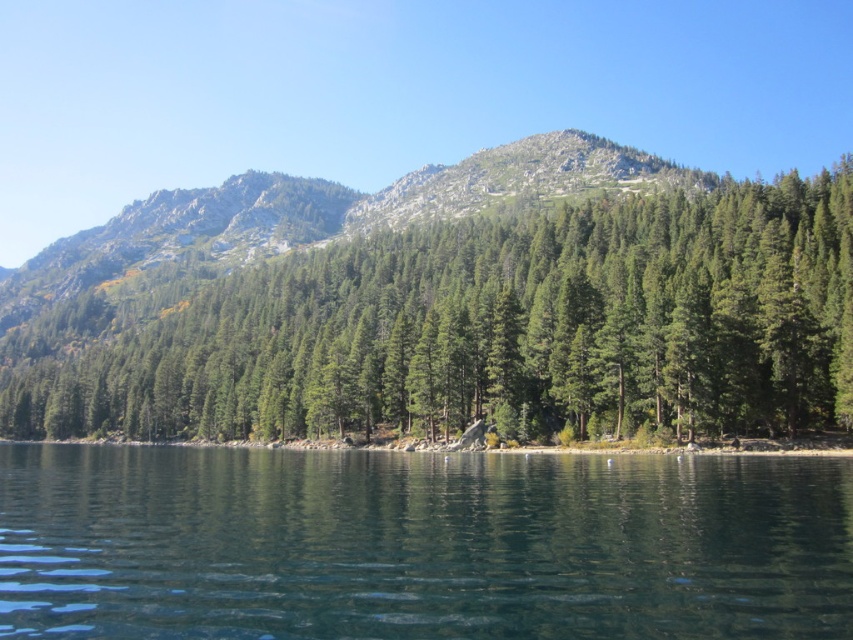
You are standing at the center of the image and want to locate the green matte tree at center. According to the coordinates provided, where exactly would you find it?

The green matte tree at center is located at the coordinates point (480,328).

You are an environmental scientist assessing the health of this forest. You observe the green matte tree at center and the green textured forest at center. Which of these has a smaller trunk diameter?

The green matte tree at center has a smaller trunk diameter than the green textured forest at center.

You are a hiker standing at the edge of the forest. You see the green smooth water at center and the green textured forest at center. Which one is closer to you?

The green smooth water at center is closer to you because it is in front of the green textured forest at center.